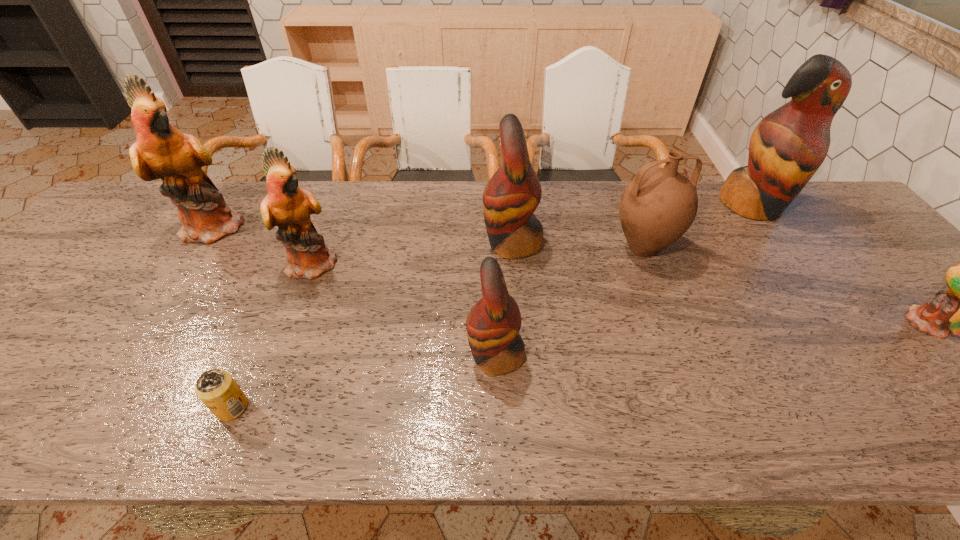
You are a GUI agent. You are given a task and a screenshot of the screen. Output one action in this format:
    pyautogui.click(x=<x>, y=<y>)
    Task: Click on the biggest green parrot
    Image resolution: width=960 pixels, height=540 pixels.
    Given the screenshot: What is the action you would take?
    pyautogui.click(x=161, y=151)

Where is `the leftmost parrot`? This screenshot has height=540, width=960. the leftmost parrot is located at coordinates (161, 151).

The image size is (960, 540). Identify the location of the second object from right to left. (788, 146).

Where is `the second parrot from right to left`? the second parrot from right to left is located at coordinates (788, 146).

Identify the location of the second biggest red parrot. The height and width of the screenshot is (540, 960). (513, 193).

The height and width of the screenshot is (540, 960). Identify the location of the second green parrot from right to left. (287, 206).

The image size is (960, 540). In order to click on the second biggest green parrot in this screenshot , I will do `click(287, 206)`.

Locate an element on the screen. This screenshot has height=540, width=960. pitcher is located at coordinates (657, 207).

Locate an element on the screen. The image size is (960, 540). brown pitcher is located at coordinates (657, 207).

Image resolution: width=960 pixels, height=540 pixels. I want to click on the smallest red parrot, so click(x=493, y=324).